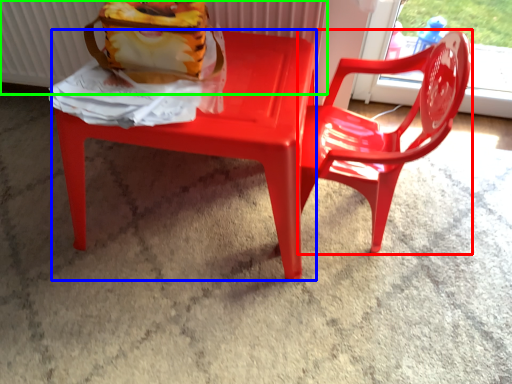
Question: Which is farther away from chair (highlighted by a red box)? chair (highlighted by a blue box) or radiator (highlighted by a green box)?

Choices:
 (A) chair
 (B) radiator

Answer: (B)